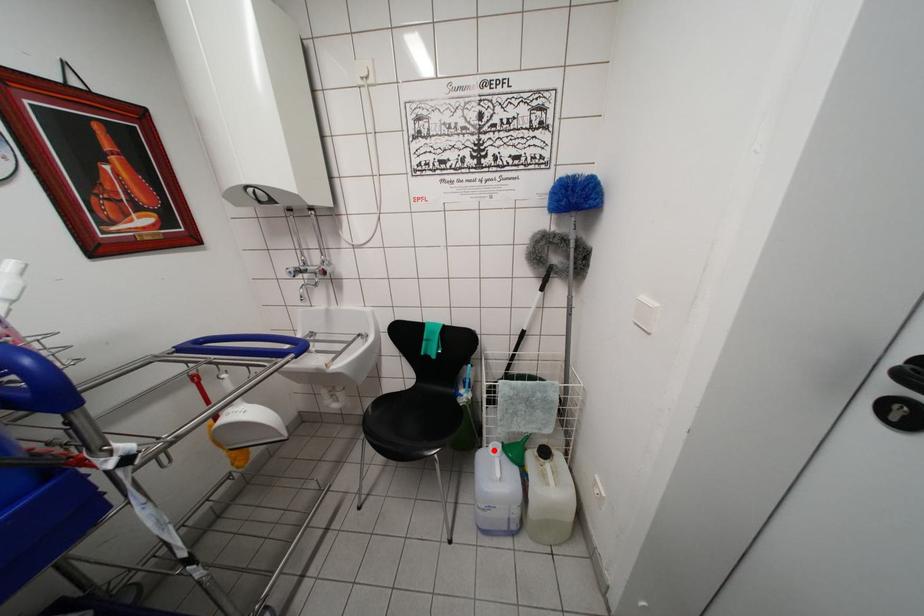
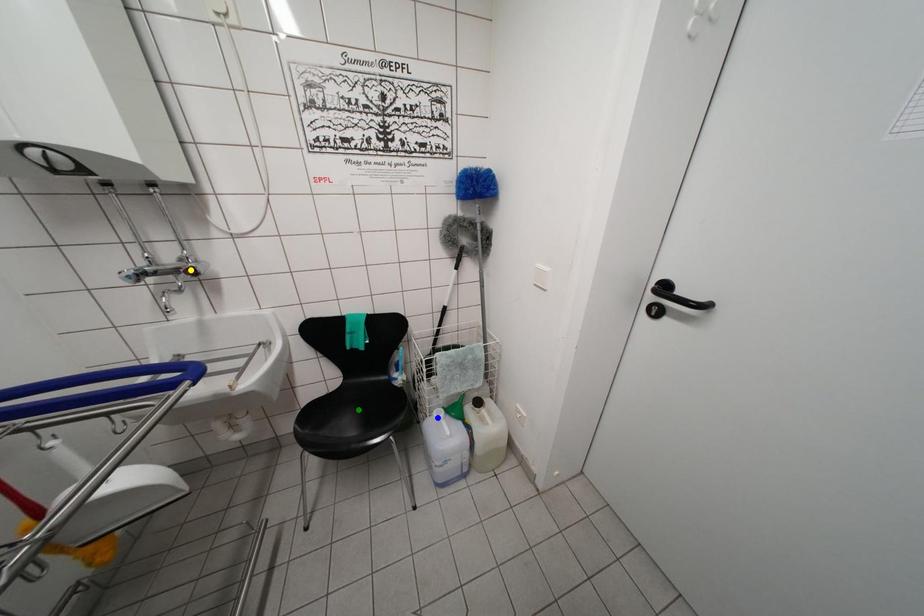
Question: I am providing you with two images of the same scene from different viewpoints. A red point is marked on the first image. You are given multiple points on the second image. Which mark in image 2 goes with the point in image 1?

Choices:
 (A) green point
 (B) blue point
 (C) yellow point

Answer: (B)